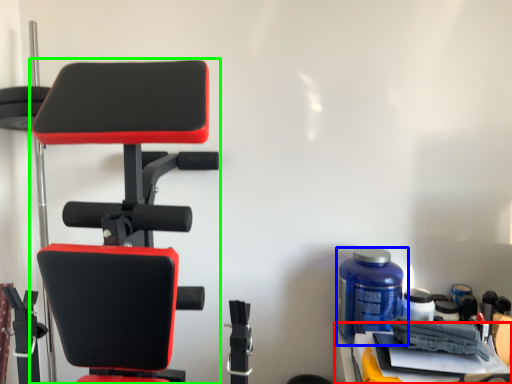
Question: Which object is the closest to the table (highlighted by a red box)? Choose among these: bottle (highlighted by a blue box) or chair (highlighted by a green box).

Choices:
 (A) bottle
 (B) chair

Answer: (A)